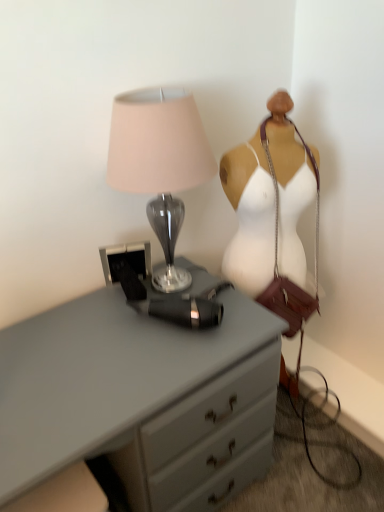
Identify the location of vacant region to the left of satin gray lamp at upper left. This screenshot has height=512, width=384. coord(78,321).